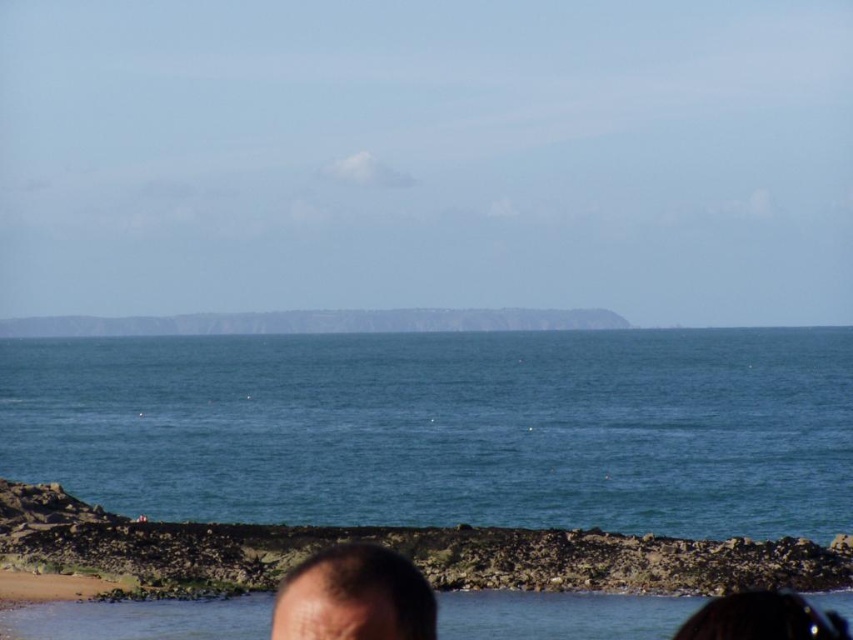
Who is more distant from viewer, (x=712, y=364) or (x=325, y=627)?

Point (x=712, y=364)

Does point (502, 486) come farther from viewer compared to point (320, 576)?

Yes, point (502, 486) is farther from viewer.

You are a GUI agent. You are given a task and a screenshot of the screen. Output one action in this format:
    pyautogui.click(x=<x>, y=<y>)
    Task: Click on the blue water at center
    
    Given the screenshot: What is the action you would take?
    pyautogui.click(x=445, y=428)

Locate an element on the screen. blue water at center is located at coordinates (445, 428).

Between blue water at center and rough stone coast at lower center, which one has more height?

blue water at center

In order to click on blue water at center in this screenshot , I will do `click(445, 428)`.

Does rough stone coast at lower center appear under dark brown hair at lower center?

Correct, rough stone coast at lower center is located below dark brown hair at lower center.

Who is lower down, rough stone coast at lower center or dark brown hair at lower center?

rough stone coast at lower center is lower down.

What do you see at coordinates (396, 548) in the screenshot? The height and width of the screenshot is (640, 853). I see `rough stone coast at lower center` at bounding box center [396, 548].

I want to click on rough stone coast at lower center, so click(x=396, y=548).